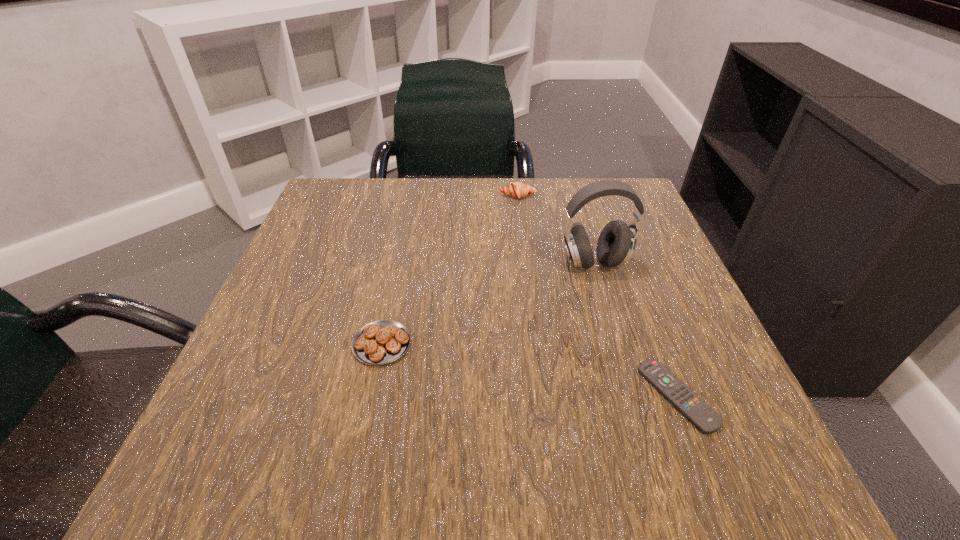
Find the location of a particular element. blank space at the far left corner of the desktop is located at coordinates (348, 186).

In the image, there is a desktop. Where is `free space at the near left corner`? free space at the near left corner is located at coordinates (300, 443).

Locate an element on the screen. This screenshot has height=540, width=960. vacant position at the far right corner of the desktop is located at coordinates (597, 202).

Where is `free space between the third nearest object and the nearer pastry`? Image resolution: width=960 pixels, height=540 pixels. free space between the third nearest object and the nearer pastry is located at coordinates (488, 303).

This screenshot has width=960, height=540. Find the location of `empty location between the nearer pastry and the second object from left to right`. empty location between the nearer pastry and the second object from left to right is located at coordinates (450, 269).

The width and height of the screenshot is (960, 540). Find the location of `free spot between the shorter pastry and the remote control`. free spot between the shorter pastry and the remote control is located at coordinates (530, 370).

The image size is (960, 540). Identify the location of unoccupied area between the left pastry and the remote control. (530, 370).

Find the location of `unoccupied area between the remote control and the headset`. unoccupied area between the remote control and the headset is located at coordinates (636, 329).

You are a GUI agent. You are given a task and a screenshot of the screen. Output one action in this format:
    pyautogui.click(x=<x>, y=<y>)
    Task: Click on the unoccupied position between the remote control and the second tallest object
    The height and width of the screenshot is (540, 960).
    Given the screenshot: What is the action you would take?
    pyautogui.click(x=598, y=296)

This screenshot has width=960, height=540. I want to click on empty location between the taller pastry and the remote control, so click(598, 296).